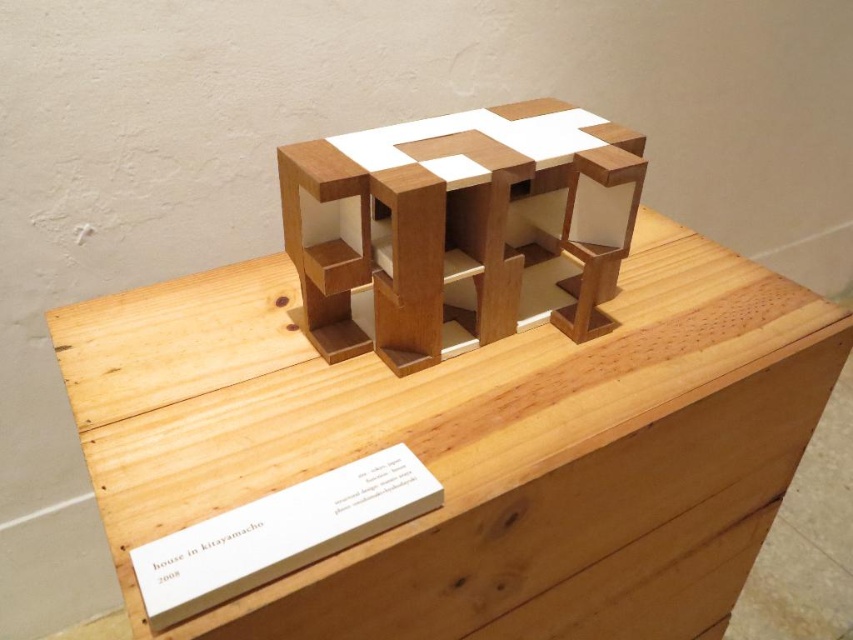
Does natural wood model at center have a greater width compared to white paper at center?

Correct, the width of natural wood model at center exceeds that of white paper at center.

Measure the distance between point [682,316] and camera.

A distance of 1.04 meters exists between point [682,316] and camera.

Where is `natural wood model at center`? natural wood model at center is located at coordinates click(x=390, y=413).